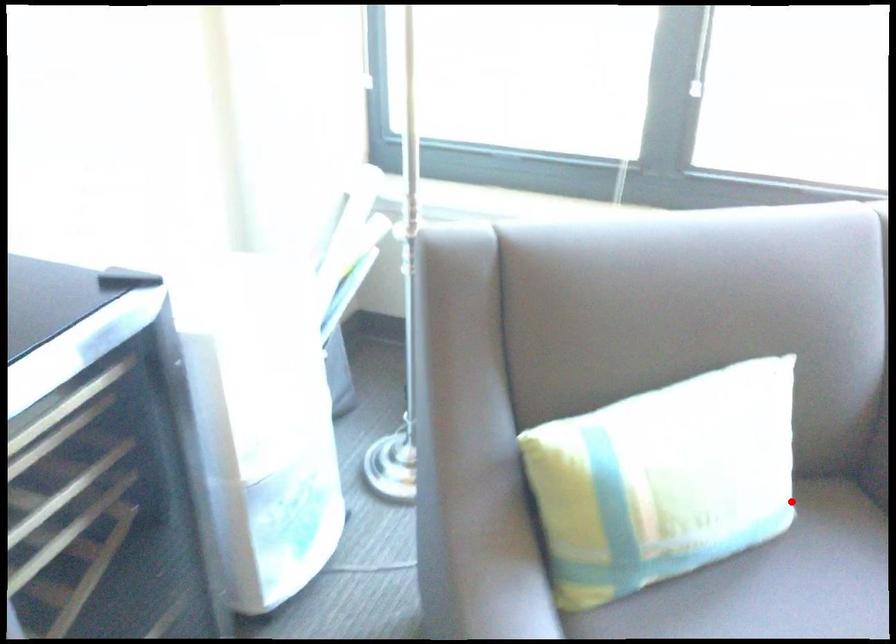
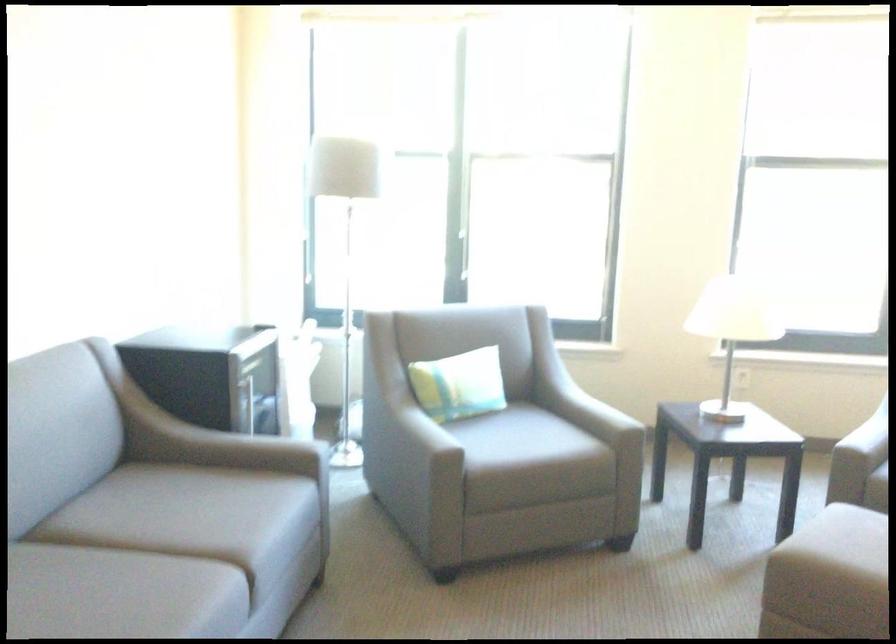
Question: A red point is marked in image1. In image2, is the corresponding 3D point closer to the camera or farther? Reply with the corresponding letter.

Choices:
 (A) The corresponding 3D point is closer.
 (B) The corresponding 3D point is farther.

Answer: (B)